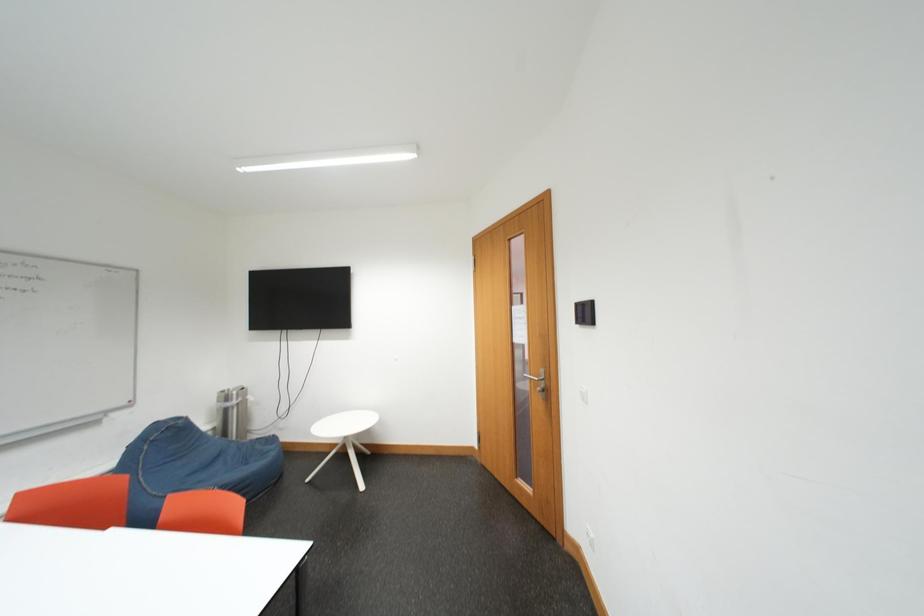
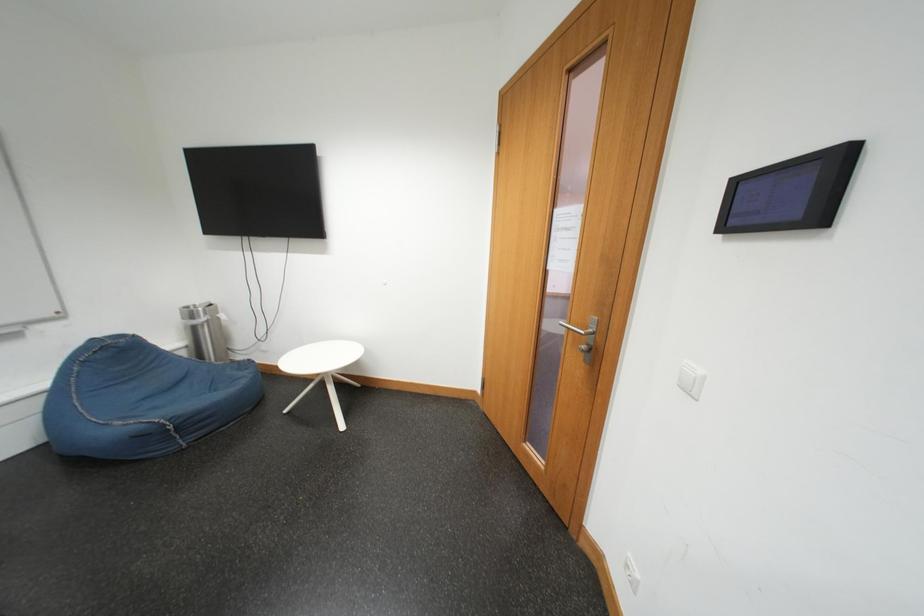
Question: How did the camera likely rotate?

Choices:
 (A) Left
 (B) Right
 (C) Up
 (D) Down

Answer: (D)